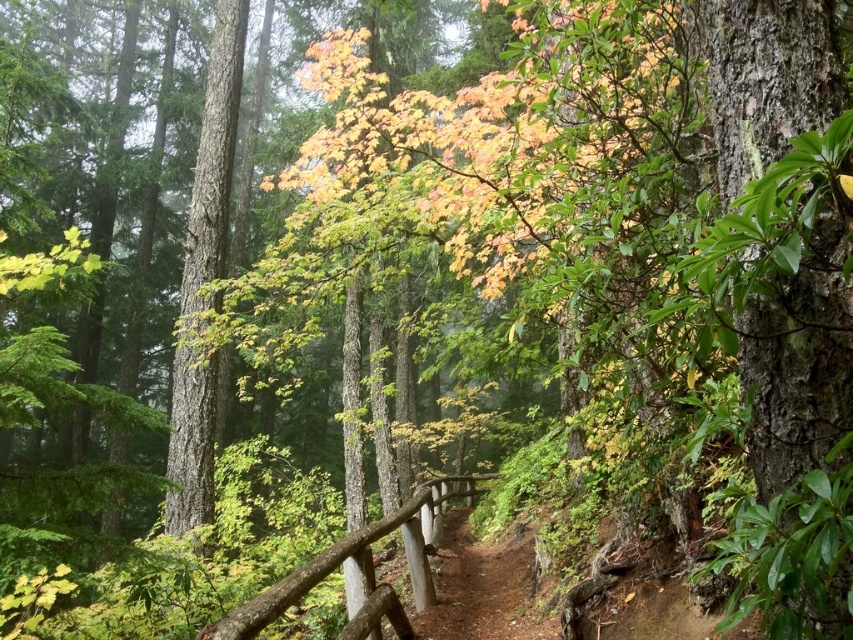
Question: Can you confirm if brown dirt trail at center is wider than brown wood rail at center?

Choices:
 (A) no
 (B) yes

Answer: (A)

Question: Does brown dirt trail at center have a greater width compared to brown wood rail at center?

Choices:
 (A) yes
 (B) no

Answer: (B)

Question: Does brown dirt trail at center appear on the left side of brown wood rail at center?

Choices:
 (A) yes
 (B) no

Answer: (B)